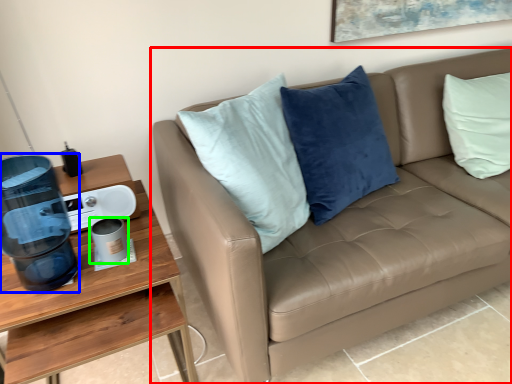
Question: Which object is the closest to the studio couch (highlighted by a red box)? Choose among these: water cooler (highlighted by a blue box) or coffee cup (highlighted by a green box).

Choices:
 (A) water cooler
 (B) coffee cup

Answer: (A)